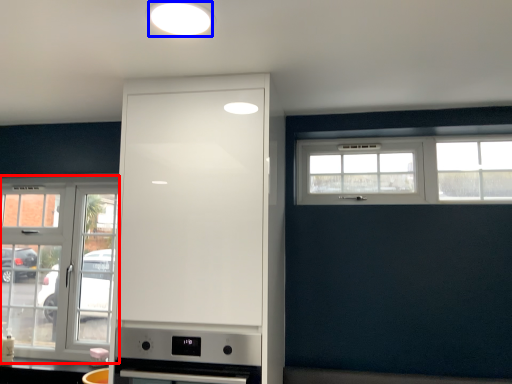
Question: Which point is closer to the camera, window (highlighted by a red box) or lighting (highlighted by a blue box)?

Choices:
 (A) window
 (B) lighting

Answer: (B)